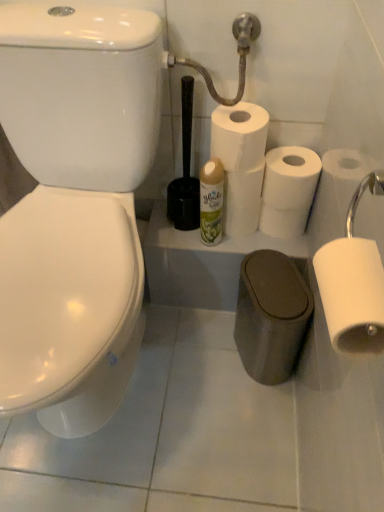
Question: Can you confirm if white matte toilet paper at center, positioned as the 2th toilet paper in back-to-front order, is wider than black plastic toilet brush at center?

Choices:
 (A) yes
 (B) no

Answer: (A)

Question: Would you say white matte toilet paper at center, positioned as the 4th toilet paper in front-to-back order, is outside black plastic toilet brush at center?

Choices:
 (A) no
 (B) yes

Answer: (B)

Question: Is white matte toilet paper at center, positioned as the 2th toilet paper in back-to-front order, oriented away from black plastic toilet brush at center?

Choices:
 (A) yes
 (B) no

Answer: (B)

Question: Is white matte toilet paper at center, positioned as the 2th toilet paper in back-to-front order, in front of black plastic toilet brush at center?

Choices:
 (A) no
 (B) yes

Answer: (A)

Question: Does white matte toilet paper at center, positioned as the 4th toilet paper in front-to-back order, appear on the left side of black plastic toilet brush at center?

Choices:
 (A) yes
 (B) no

Answer: (B)

Question: In terms of size, does white matte toilet paper at center right, which is counted as the third toilet paper, starting from the front, appear bigger or smaller than white matte toilet paper at center, positioned as the 4th toilet paper in front-to-back order?

Choices:
 (A) big
 (B) small

Answer: (A)

Question: Is point click(x=279, y=180) closer or farther from the camera than point click(x=296, y=228)?

Choices:
 (A) closer
 (B) farther

Answer: (A)

Question: From the image's perspective, is white matte toilet paper at center right, which is counted as the third toilet paper, starting from the front, above or below white matte toilet paper at center, positioned as the 4th toilet paper in front-to-back order?

Choices:
 (A) below
 (B) above

Answer: (B)

Question: Would you say white matte toilet paper at center right, which is counted as the third toilet paper, starting from the front, is to the left or to the right of white matte toilet paper at center, positioned as the 4th toilet paper in front-to-back order, in the picture?

Choices:
 (A) left
 (B) right

Answer: (A)

Question: Considering the positions of point (276, 221) and point (213, 238), is point (276, 221) closer or farther from the camera than point (213, 238)?

Choices:
 (A) farther
 (B) closer

Answer: (A)

Question: In terms of height, does white matte toilet paper at center, positioned as the 2th toilet paper in back-to-front order, look taller or shorter compared to white glossy air freshener at center?

Choices:
 (A) tall
 (B) short

Answer: (B)

Question: Relative to white glossy air freshener at center, is white matte toilet paper at center, positioned as the 2th toilet paper in back-to-front order, in front or behind?

Choices:
 (A) behind
 (B) front

Answer: (A)

Question: From the image's perspective, is white matte toilet paper at center, positioned as the 2th toilet paper in back-to-front order, above or below white glossy air freshener at center?

Choices:
 (A) above
 (B) below

Answer: (B)

Question: Choose the correct answer: Is white matte toilet paper at center, positioned as the 4th toilet paper in front-to-back order, inside white matte toilet paper at right, which ranks as the 5th toilet paper in back-to-front order, or outside it?

Choices:
 (A) outside
 (B) inside

Answer: (A)

Question: Based on their positions, is white matte toilet paper at center, positioned as the 4th toilet paper in front-to-back order, located to the left or right of white matte toilet paper at right, acting as the first toilet paper starting from the front?

Choices:
 (A) right
 (B) left

Answer: (A)